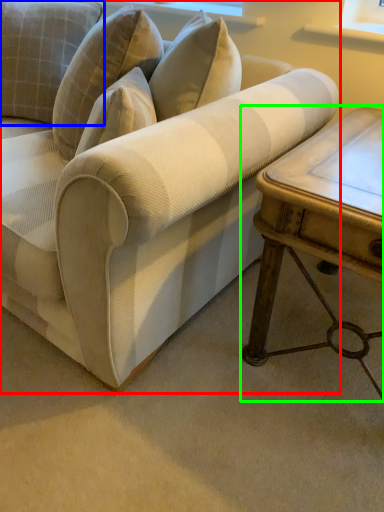
Question: Which is farther away from studio couch (highlighted by a red box)? pillow (highlighted by a blue box) or table (highlighted by a green box)?

Choices:
 (A) pillow
 (B) table

Answer: (A)